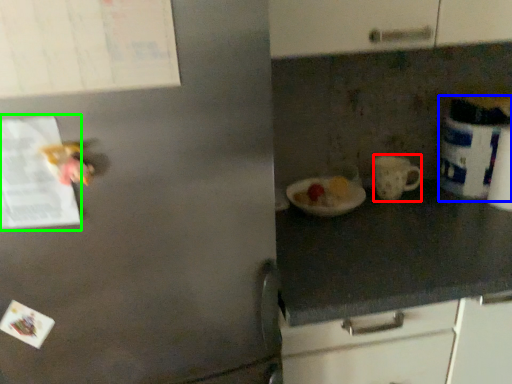
Question: Which object is positioned closest to mug (highlighted by a red box)? Select from appliance (highlighted by a blue box) and paper (highlighted by a green box).

Choices:
 (A) appliance
 (B) paper

Answer: (A)